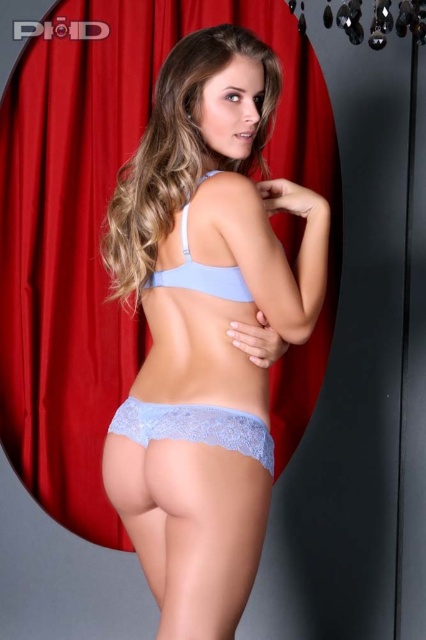
Question: Which object is positioned closest to the light blue lace underwear at center?

Choices:
 (A) lacy blue underwear at lower center
 (B) light blue lace bikini top at center
 (C) light blue lace bra at center

Answer: (C)

Question: Which of the following is the closest to the observer?

Choices:
 (A) light blue lace bra at center
 (B) light blue lace bikini top at center
 (C) light blue lace underwear at center

Answer: (C)

Question: Can you confirm if light blue lace underwear at center is positioned above lacy blue underwear at lower center?

Choices:
 (A) no
 (B) yes

Answer: (B)

Question: Is lacy blue underwear at lower center further to camera compared to light blue lace bikini top at center?

Choices:
 (A) yes
 (B) no

Answer: (B)

Question: Which object appears farthest from the camera in this image?

Choices:
 (A) light blue lace bikini top at center
 (B) light blue lace bra at center
 (C) lacy blue underwear at lower center
 (D) light blue lace underwear at center

Answer: (A)

Question: Is light blue lace underwear at center smaller than light blue lace bra at center?

Choices:
 (A) yes
 (B) no

Answer: (B)